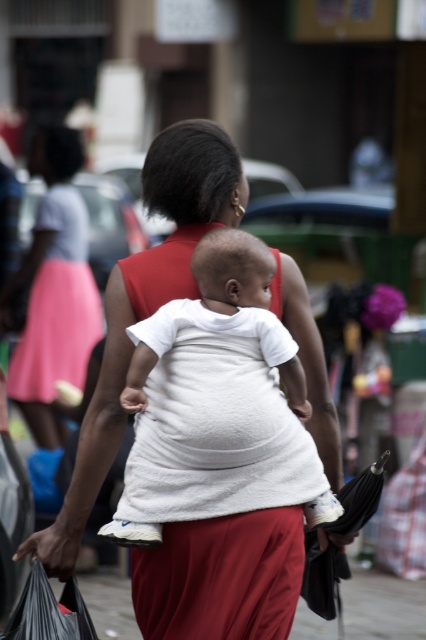
Based on the scene description, where is the white soft fabric baby at center located in terms of coordinates?

The white soft fabric baby at center is located at point coordinates of (216,394).

You are a photographer trying to capture a photo of the white soft fabric baby at center and the pink fabric skirt at left. Which object should you focus on if you want to highlight the one that is shorter?

The white soft fabric baby at center has a lesser height compared to the pink fabric skirt at left, so you should focus on the white soft fabric baby at center to highlight the shorter one.

You are a photographer trying to capture a candid shot of the street scene. You notice the white matte shirt at center and the pink fabric skirt at left. Which object should you focus on to ensure it takes up more of your photo?

The pink fabric skirt at left should be focused on because it occupies more space than the white matte shirt at center.